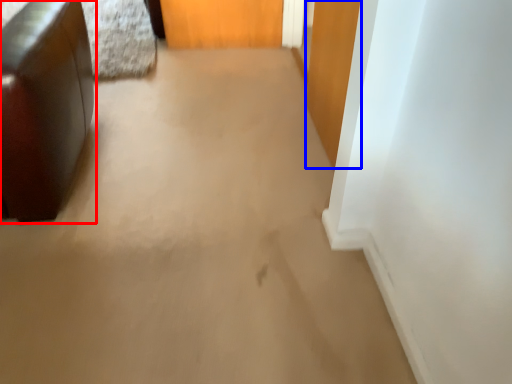
Question: Which object appears closest to the camera in this image, furniture (highlighted by a red box) or door (highlighted by a blue box)?

Choices:
 (A) furniture
 (B) door

Answer: (A)